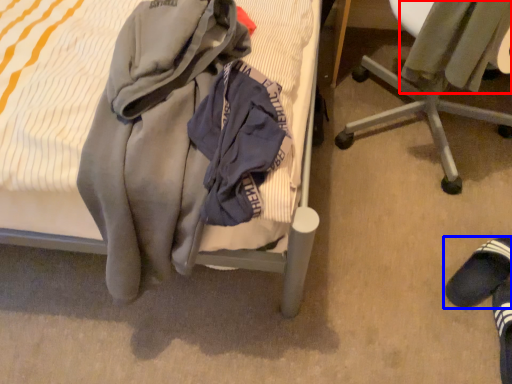
Question: Which of the following is the closest to the observer, sweater (highlighted by a red box) or footwear (highlighted by a blue box)?

Choices:
 (A) sweater
 (B) footwear

Answer: (A)